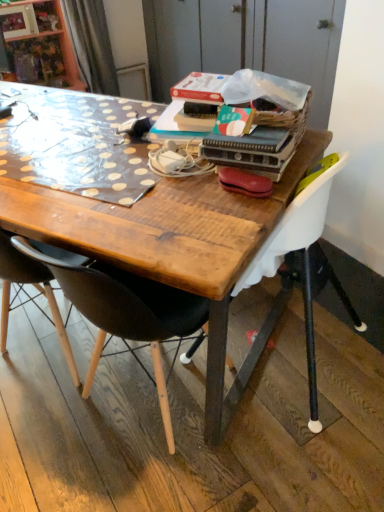
Question: Does point (64, 286) appear closer or farther from the camera than point (304, 237)?

Choices:
 (A) closer
 (B) farther

Answer: (A)

Question: From a real-world perspective, is black plastic chair at center, which appears as the 2th chair when viewed from the right, positioned above or below white plastic chair at upper right, placed as the second chair when sorted from left to right?

Choices:
 (A) below
 (B) above

Answer: (A)

Question: Estimate the real-world distances between objects in this image. Which object is farther from the wooden desk at center?

Choices:
 (A) white plastic chair at upper right, placed as the second chair when sorted from left to right
 (B) black plastic chair at center, which is the first chair from left to right
 (C) leather-like brown handbag at center

Answer: (C)

Question: Estimate the real-world distances between objects in this image. Which object is farther from the black plastic chair at center, which appears as the 2th chair when viewed from the right?

Choices:
 (A) wooden desk at center
 (B) leather-like brown handbag at center
 (C) white plastic chair at upper right, which is the 1th chair from right to left

Answer: (B)